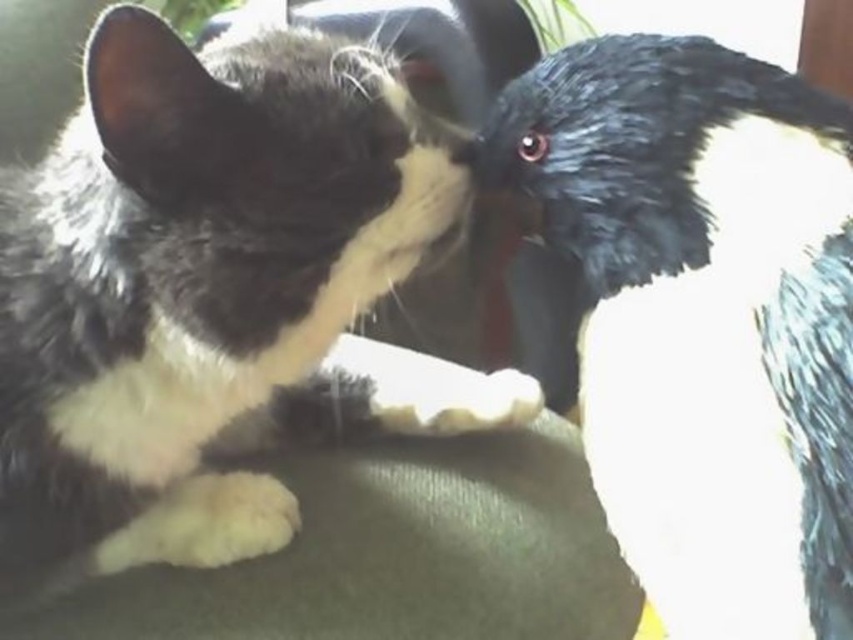
You are observing a cat and a bird in the image. The cat is at point (112, 420) and the bird is at point (453, 154). Which animal is closer to you?

The cat at point (112, 420) is closer to you because it is in front of the bird at point (453, 154).

You are a photographer trying to capture a close shot of the black fuzzy nose at center. The black and white fur cat at center is blocking your view. Can you move the cat to the side so you can focus on the nose?

The black and white fur cat at center is positioned under the black fuzzy nose at center, so moving the cat to the side would allow you to focus on the black fuzzy nose at center.